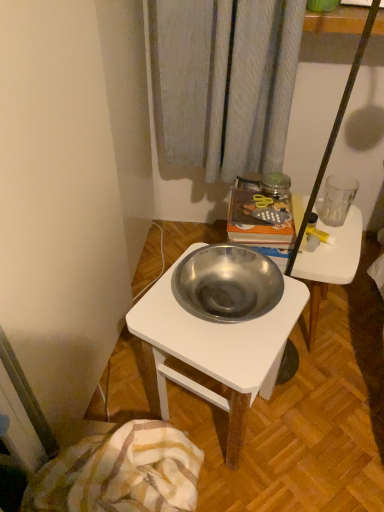
Question: Is metallic white desk at center to the left or to the right of metallic silver bowl at center in the image?

Choices:
 (A) left
 (B) right

Answer: (A)

Question: Is metallic white desk at center in front of or behind metallic silver bowl at center in the image?

Choices:
 (A) front
 (B) behind

Answer: (A)

Question: Estimate the real-world distances between objects in this image. Which object is farther from the transparent glass at right?

Choices:
 (A) metallic silver bowl at center
 (B) plaid cotton blanket at lower left
 (C) metallic white desk at center

Answer: (B)

Question: Which object is positioned closest to the transparent glass at right?

Choices:
 (A) metallic white desk at center
 (B) metallic silver bowl at center
 (C) plaid cotton blanket at lower left

Answer: (B)